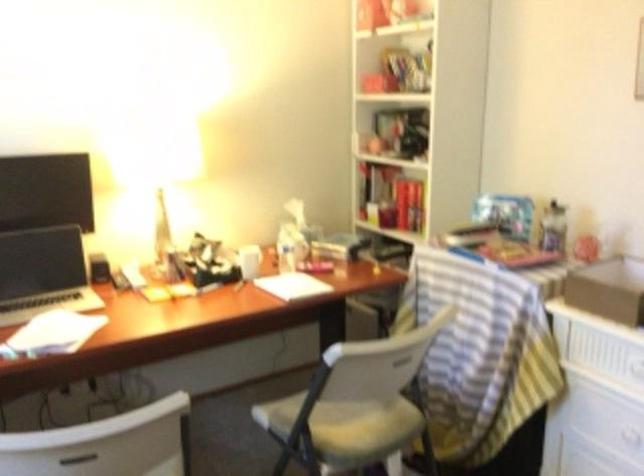
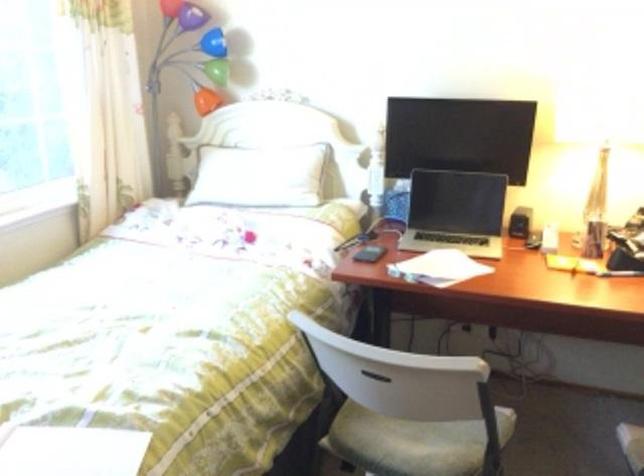
Question: Based on the continuous images, in which direction is the camera rotating? Reply with the corresponding letter.

Choices:
 (A) Left
 (B) Right
 (C) Up
 (D) Down

Answer: (A)